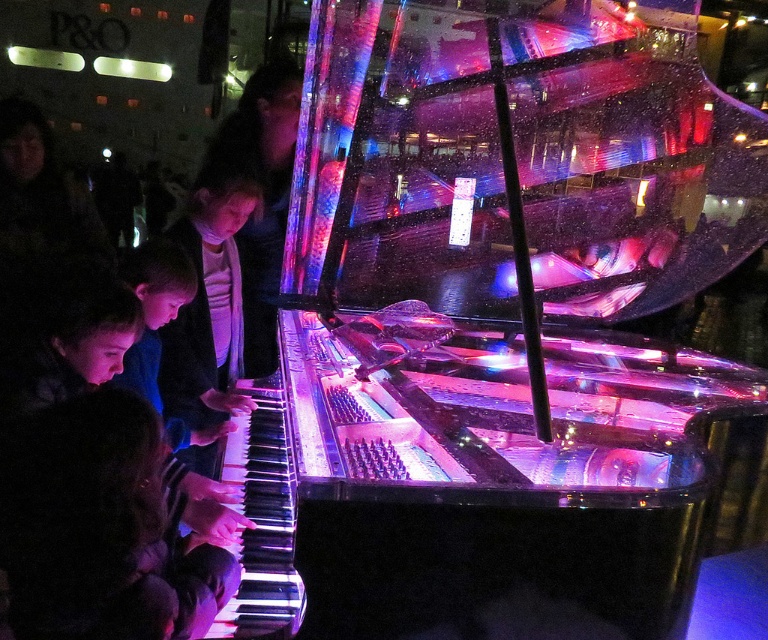
You are a photographer standing in front of the matte black piano keys at left and the dark hair at lower left. You want to take a photo that includes both objects in the frame. Which object should you position closer to the bottom of the photo?

You should position the dark hair at lower left closer to the bottom of the photo because it is located below the matte black piano keys at left.